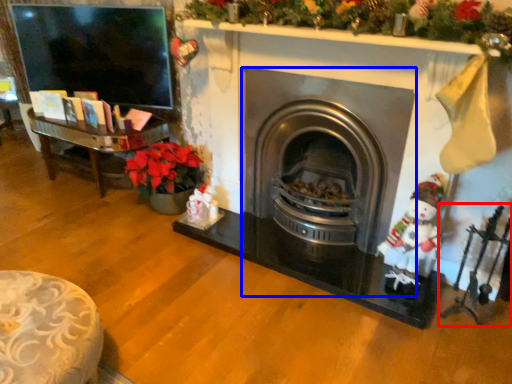
Question: Which object appears farthest to the camera in this image, toy (highlighted by a red box) or wood burning stove (highlighted by a blue box)?

Choices:
 (A) toy
 (B) wood burning stove

Answer: (B)